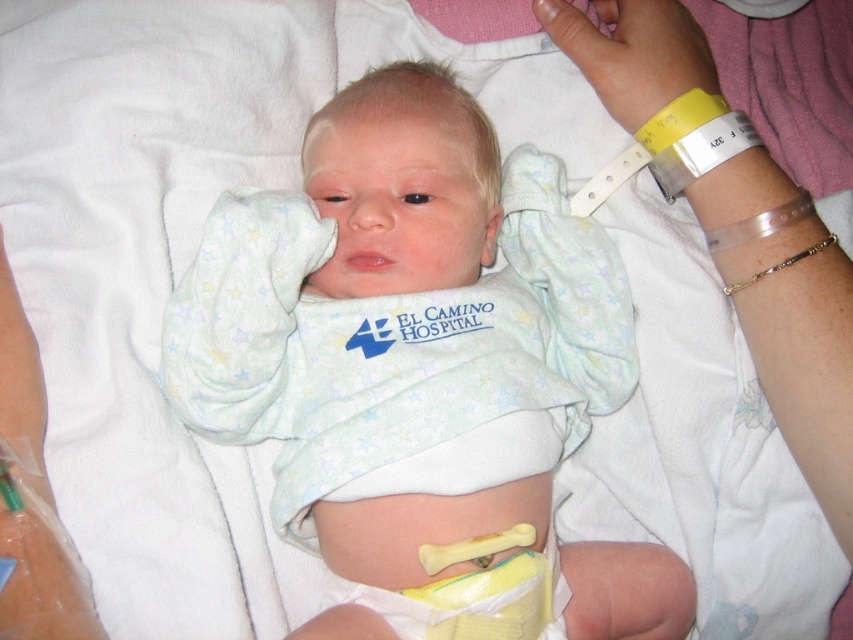
You are a nurse in a hospital. You need to place a small medical device on the baby. The device must be placed exactly at the point marked as point (422, 371). However, there is already an object at that location. What object is at that point?

The light blue cotton onesie at center is located at point (422, 371), so the medical device cannot be placed there as the location is already occupied by the light blue cotton onesie at center.

What is the relationship between the height of the light blue cotton onesie at center and the yellow plastic wristband at upper right?

The light blue cotton onesie at center is taller than the yellow plastic wristband at upper right.

You are a nurse in a hospital. You need to place the light blue cotton onesie at center and the yellow plastic wristband at upper right onto a small tray. If the tray has limited space, which item should you place first to ensure both fit?

The yellow plastic wristband at upper right should be placed first because it is narrower than the light blue cotton onesie at center, allowing more space for the larger item afterward.